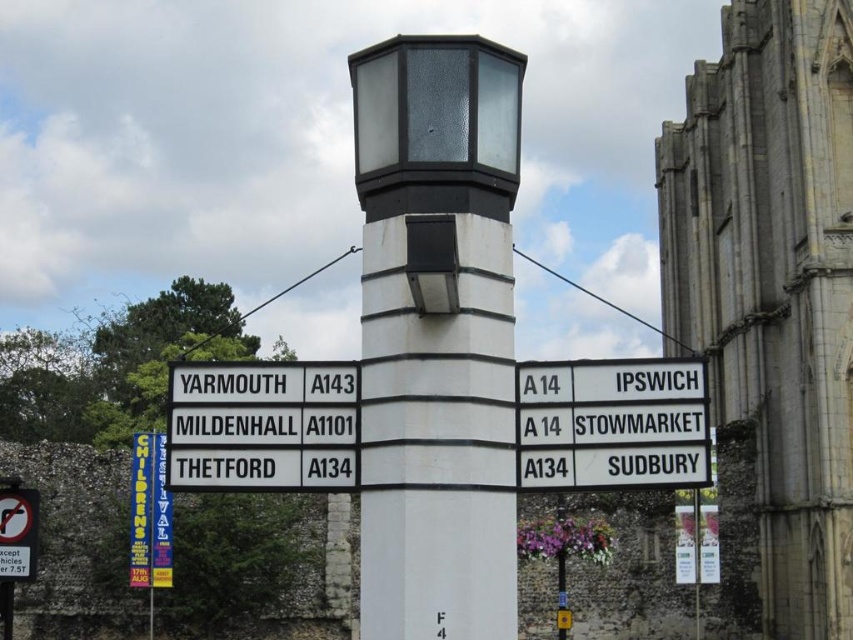
Question: Which object appears farthest from the camera in this image?

Choices:
 (A) white plastic sign at center right
 (B) blue fabric banner at lower left
 (C) white textured pillar at center

Answer: (B)

Question: Considering the real-world distances, which object is farthest from the black plastic sign at lower left?

Choices:
 (A) white plastic sign at center right
 (B) blue fabric banner at lower left
 (C) white plastic sign at left

Answer: (B)

Question: Does white plastic sign at left have a larger size compared to black plastic sign at lower left?

Choices:
 (A) no
 (B) yes

Answer: (B)

Question: Is blue fabric banner at lower left closer to camera compared to black plastic sign at lower left?

Choices:
 (A) no
 (B) yes

Answer: (A)

Question: Can you confirm if white plastic sign at left is bigger than blue fabric banner at lower left?

Choices:
 (A) no
 (B) yes

Answer: (A)

Question: Which object is the farthest from the blue fabric banner at lower left?

Choices:
 (A) white plastic sign at center right
 (B) white plastic sign at left
 (C) white textured pillar at center
 (D) black plastic sign at lower left

Answer: (A)